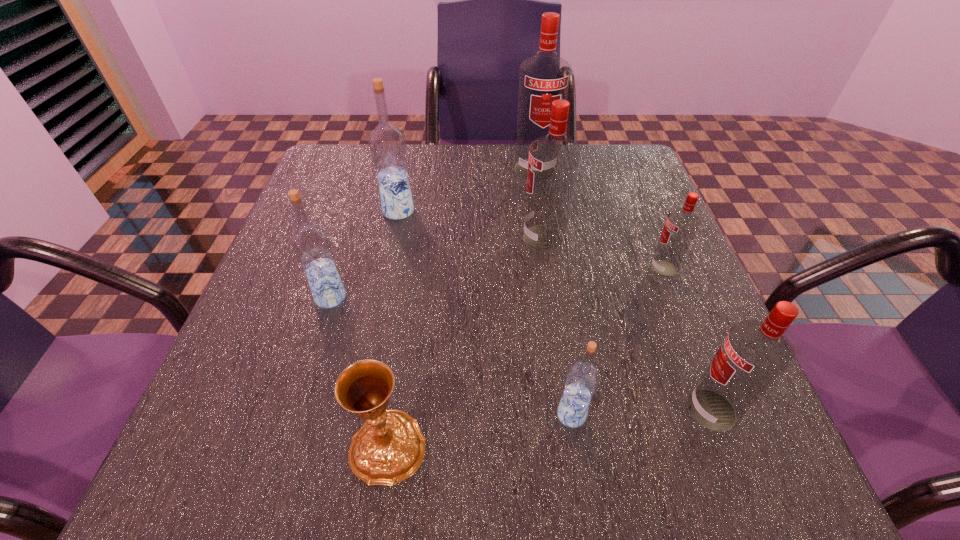
Find the location of `free space that is in between the second farthest vodka and the third biggest red vodka`. free space that is in between the second farthest vodka and the third biggest red vodka is located at coordinates (555, 310).

At what (x,y) coordinates should I click in order to perform the action: click on free space that is in between the sixth nearest vodka and the third biggest red vodka. Please return your answer as a coordinate pair (x, y). Image resolution: width=960 pixels, height=540 pixels. Looking at the image, I should click on (555, 310).

Where is `free point between the smallest blue vodka and the second farthest blue vodka`? The height and width of the screenshot is (540, 960). free point between the smallest blue vodka and the second farthest blue vodka is located at coordinates (451, 356).

At what (x,y) coordinates should I click in order to perform the action: click on vacant region between the second biggest blue vodka and the fourth nearest vodka. Please return your answer as a coordinate pair (x, y). Looking at the image, I should click on (497, 283).

The height and width of the screenshot is (540, 960). Find the location of `free space between the nearest blue vodka and the chalice`. free space between the nearest blue vodka and the chalice is located at coordinates (480, 430).

This screenshot has height=540, width=960. What are the coordinates of `empty location between the chalice and the smallest blue vodka` in the screenshot? It's located at (480, 430).

Find the location of a particular element. blank region between the nearest blue vodka and the second vodka from left to right is located at coordinates (485, 313).

At what (x,y) coordinates should I click in order to perform the action: click on free space between the nearest blue vodka and the leftmost vodka. Please return your answer as a coordinate pair (x, y). Looking at the image, I should click on (451, 356).

At what (x,y) coordinates should I click in order to perform the action: click on object that stands as the fifth closest to the third farthest object. Please return your answer as a coordinate pair (x, y). The image size is (960, 540). Looking at the image, I should click on (754, 354).

The width and height of the screenshot is (960, 540). I want to click on the fifth closest object relative to the farthest object, so click(754, 354).